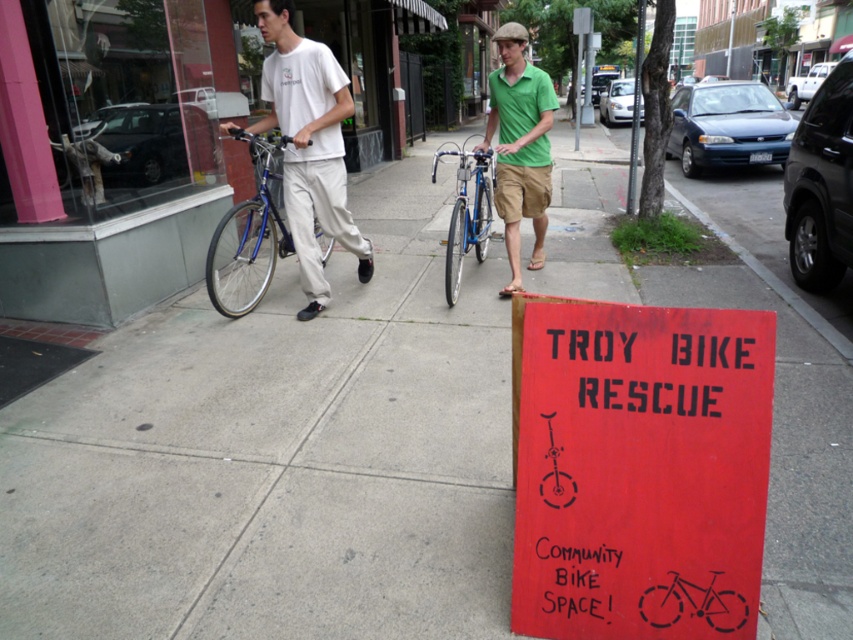
Question: Is green cotton shirt at center above shiny blue bike at center?

Choices:
 (A) no
 (B) yes

Answer: (A)

Question: Which of the following is the closest to the observer?

Choices:
 (A) pos(265,58)
 (B) pos(509,172)
 (C) pos(727,451)
 (D) pos(259,140)

Answer: (C)

Question: Among these points, which one is farthest from the camera?

Choices:
 (A) (631, 592)
 (B) (216, 304)
 (C) (498, 196)
 (D) (454, 275)

Answer: (D)

Question: Is white matte t-shirt at center thinner than green cotton shirt at center?

Choices:
 (A) yes
 (B) no

Answer: (B)

Question: Estimate the real-world distances between objects in this image. Which object is farther from the shiny blue bike at center?

Choices:
 (A) green cotton shirt at center
 (B) shiny blue bike at left
 (C) red wood sign at center
 (D) white matte t-shirt at center

Answer: (A)

Question: In this image, where is red wood sign at center located relative to shiny blue bike at left?

Choices:
 (A) above
 (B) below

Answer: (B)